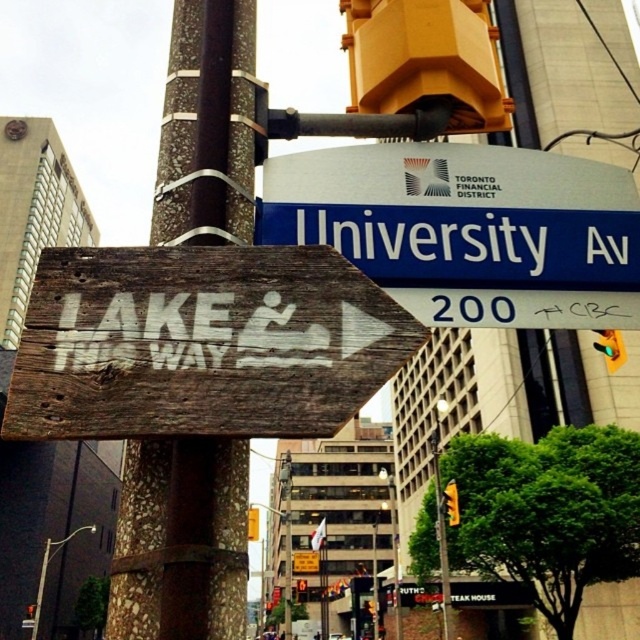
In the scene shown: You are standing at the intersection and see two points marked on the ground. The first point is at coordinates point (131, 467) and the second point is at point (458, 237). Which point is closer to you?

Point (131, 467) is closer to the viewer than point (458, 237).

You are a delivery person trying to attach a package label to the brown textured pole at center and the blue plastic street sign at upper center. Which object should you choose if you want to place the label on the larger one?

The brown textured pole at center is bigger than the blue plastic street sign at upper center, so you should choose the brown textured pole at center to place the label on the larger one.